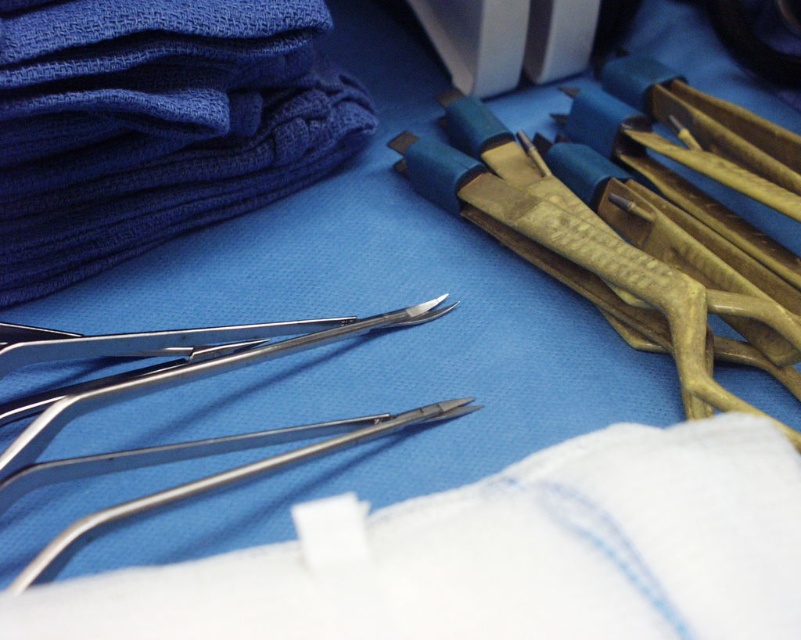
You are a surgical nurse preparing for an operation. You need to place a 20 inch long medical tool between the blue fabric at upper left and the polished metal forceps at center. Is there enough space?

The blue fabric at upper left and the polished metal forceps at center are 18.97 inches apart. Since the tool is 20 inches long, it would not fit between them as the distance is shorter than the tool.

You are a surgeon preparing to operate and need to reach the point at coordinates point [425,184]. The camera is positioned at a certain distance. Can you estimate how far you need to move your hand to reach that point from your current position?

The point [425,184] and the camera are 3.96 feet apart from each other, so you need to move your hand approximately 3.96 feet to reach the point from your current position.

You are a surgical nurse preparing for an operation. You need to place a new instrument tray between the blue fabric at upper left and the gold textured forceps at upper right. Based on their positions, where should you place the tray?

The blue fabric at upper left is to the left of gold textured forceps at upper right, so you should place the instrument tray between them, ensuring it is positioned to the right of the blue fabric at upper left and to the left of the gold textured forceps at upper right.